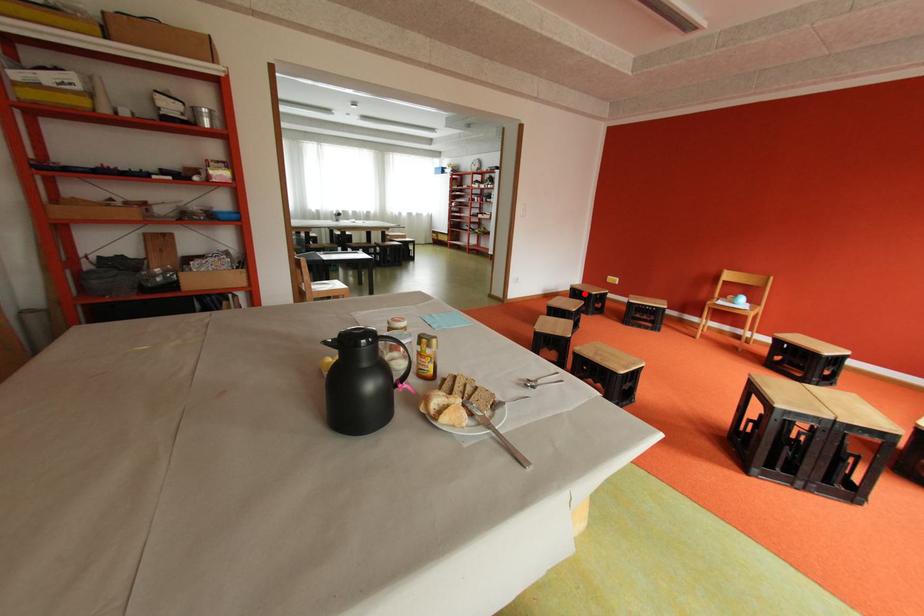
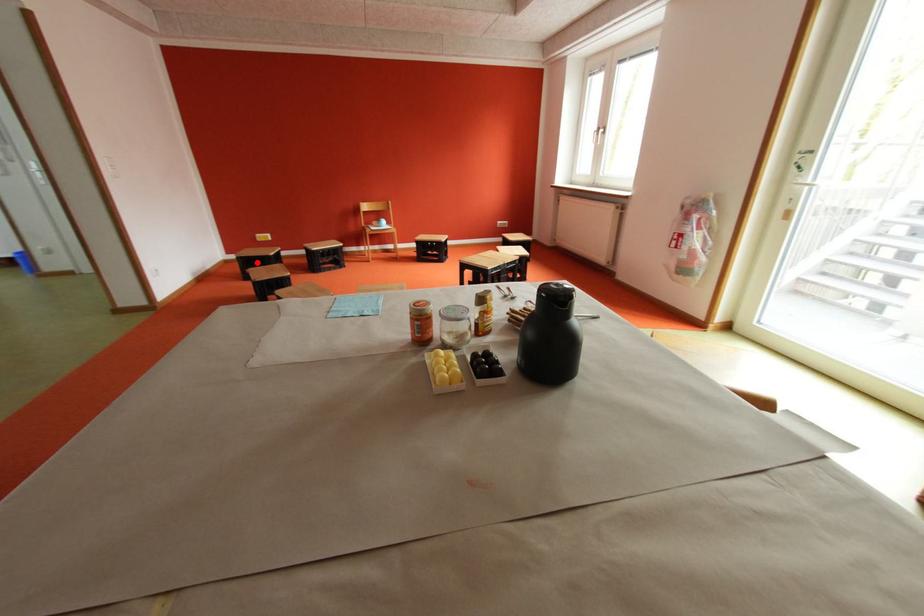
I am providing you with two images of the same scene from different viewpoints. A red point is marked on the first image and another point is marked on the second image. Is the marked point in image1 the same physical position as the marked point in image2?

Yes